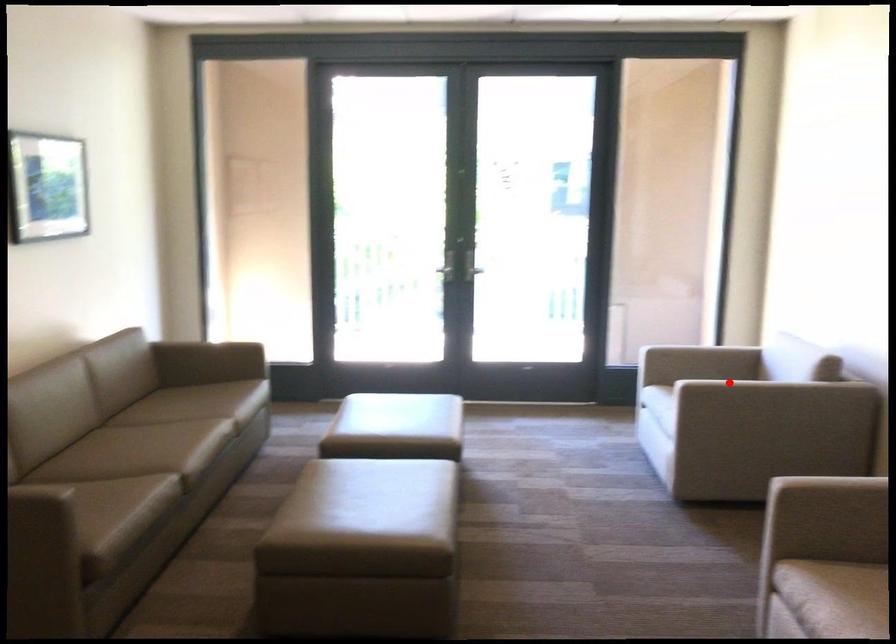
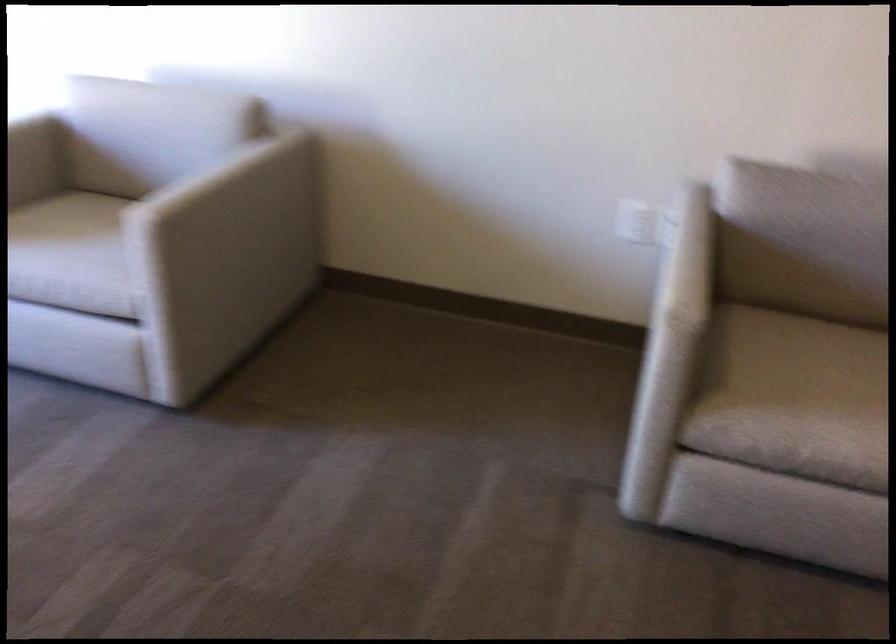
In the second image, find the point that corresponds to the highlighted location in the first image.

(209, 180)